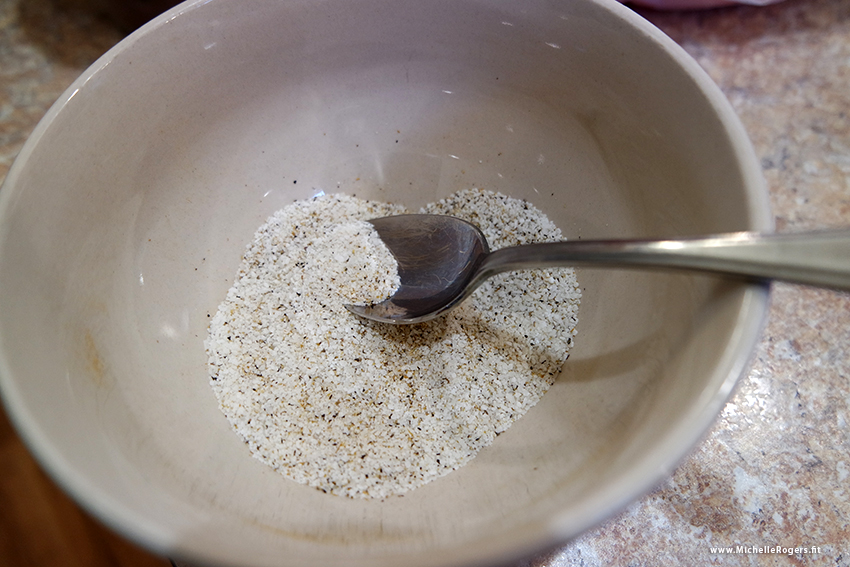
Image resolution: width=850 pixels, height=567 pixels. What are the coordinates of `handle` in the screenshot? It's located at [x=775, y=253].